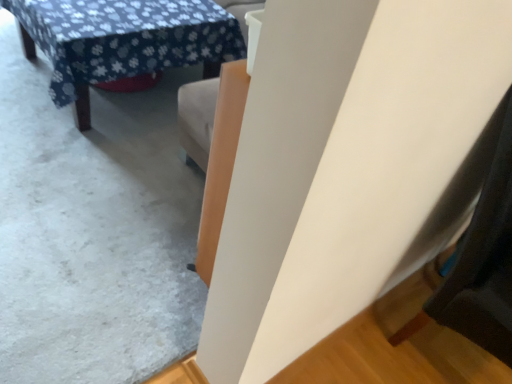
The image size is (512, 384). Describe the element at coordinates (93, 230) in the screenshot. I see `white matte wall at upper center` at that location.

Find the location of `white matte wall at upper center`. white matte wall at upper center is located at coordinates (93, 230).

At what (x,y) coordinates should I click in order to perform the action: click on blue floral fabric table at upper left. Please return your answer as a coordinate pair (x, y). The height and width of the screenshot is (384, 512). Looking at the image, I should click on (123, 40).

What do you see at coordinates (123, 40) in the screenshot? The image size is (512, 384). I see `blue floral fabric table at upper left` at bounding box center [123, 40].

Where is `white matte wall at upper center`? This screenshot has height=384, width=512. white matte wall at upper center is located at coordinates (93, 230).

Is white matte wall at upper center to the right of blue floral fabric table at upper left from the viewer's perspective?

No.

Which is in front, white matte wall at upper center or blue floral fabric table at upper left?

white matte wall at upper center is more forward.

Which is in front, point (148, 278) or point (202, 57)?

Point (148, 278)

Looking at this image, from the image's perspective, is white matte wall at upper center located above blue floral fabric table at upper left?

Incorrect, from the image's perspective, white matte wall at upper center is lower than blue floral fabric table at upper left.

From a real-world perspective, does white matte wall at upper center stand above blue floral fabric table at upper left?

No, from a real-world perspective, white matte wall at upper center is not over blue floral fabric table at upper left

Can you confirm if white matte wall at upper center is thinner than blue floral fabric table at upper left?

No, white matte wall at upper center is not thinner than blue floral fabric table at upper left.

Between white matte wall at upper center and blue floral fabric table at upper left, which one has less height?

Standing shorter between the two is white matte wall at upper center.

Who is smaller, white matte wall at upper center or blue floral fabric table at upper left?

white matte wall at upper center is smaller.

Can we say white matte wall at upper center lies outside blue floral fabric table at upper left?

Yes, white matte wall at upper center is located beyond the bounds of blue floral fabric table at upper left.

Is white matte wall at upper center touching blue floral fabric table at upper left?

No.

Is white matte wall at upper center oriented away from blue floral fabric table at upper left?

That's not correct — white matte wall at upper center is not looking away from blue floral fabric table at upper left.

How many degrees apart are the facing directions of white matte wall at upper center and blue floral fabric table at upper left?

They differ by 90.4 degrees in their facing directions.

How far apart are white matte wall at upper center and blue floral fabric table at upper left?

They are 50.37 centimeters apart.

What are the coordinates of `concrete in front of the blue floral fabric table at upper left` in the screenshot? It's located at (93, 230).

Considering the relative positions of blue floral fabric table at upper left and white matte wall at upper center in the image provided, is blue floral fabric table at upper left to the right of white matte wall at upper center from the viewer's perspective?

A: Indeed, blue floral fabric table at upper left is positioned on the right side of white matte wall at upper center.

Which object is closer to the camera, blue floral fabric table at upper left or white matte wall at upper center?

white matte wall at upper center is in front.

Which point is more distant from viewer, (61, 43) or (164, 303)?

The point (61, 43) is behind.

From the image's perspective, who appears lower, blue floral fabric table at upper left or white matte wall at upper center?

white matte wall at upper center is shown below in the image.

From a real-world perspective, is blue floral fabric table at upper left under white matte wall at upper center?

No, from a real-world perspective, blue floral fabric table at upper left is not beneath white matte wall at upper center.

Between blue floral fabric table at upper left and white matte wall at upper center, which one has larger width?

With larger width is white matte wall at upper center.

Does blue floral fabric table at upper left have a lesser height compared to white matte wall at upper center?

In fact, blue floral fabric table at upper left may be taller than white matte wall at upper center.

Is blue floral fabric table at upper left bigger than white matte wall at upper center?

Indeed, blue floral fabric table at upper left has a larger size compared to white matte wall at upper center.

Based on the photo, is blue floral fabric table at upper left not within white matte wall at upper center?

Yes.

Is blue floral fabric table at upper left positioned far away from white matte wall at upper center?

No.

Is blue floral fabric table at upper left oriented towards white matte wall at upper center?

No, blue floral fabric table at upper left is not oriented towards white matte wall at upper center.

Locate an element on the screen. The height and width of the screenshot is (384, 512). table located on the right of white matte wall at upper center is located at coordinates (123, 40).

Locate an element on the screen. Image resolution: width=512 pixels, height=384 pixels. concrete on the left of the blue floral fabric table at upper left is located at coordinates (93, 230).

Find the location of a particular element. The image size is (512, 384). concrete in front of the blue floral fabric table at upper left is located at coordinates (93, 230).